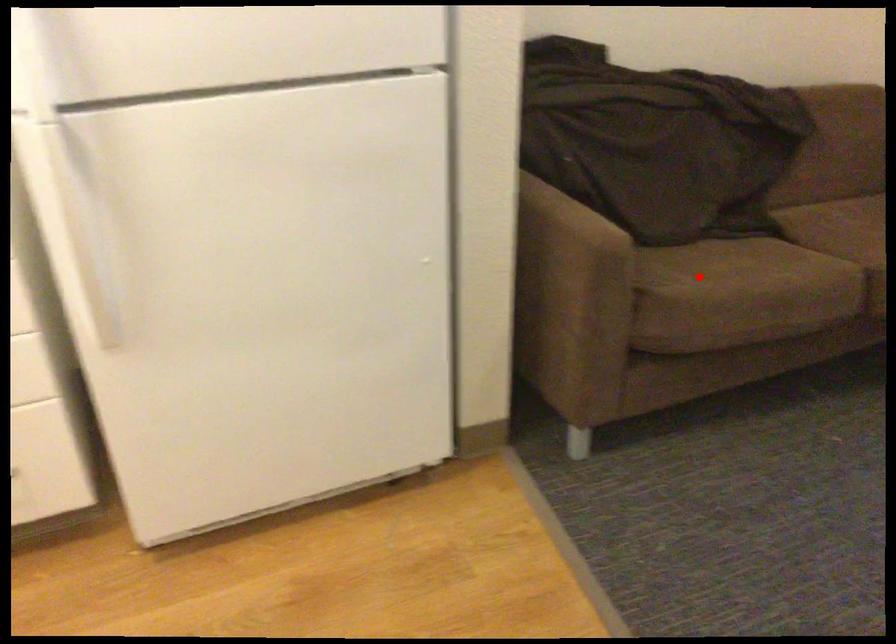
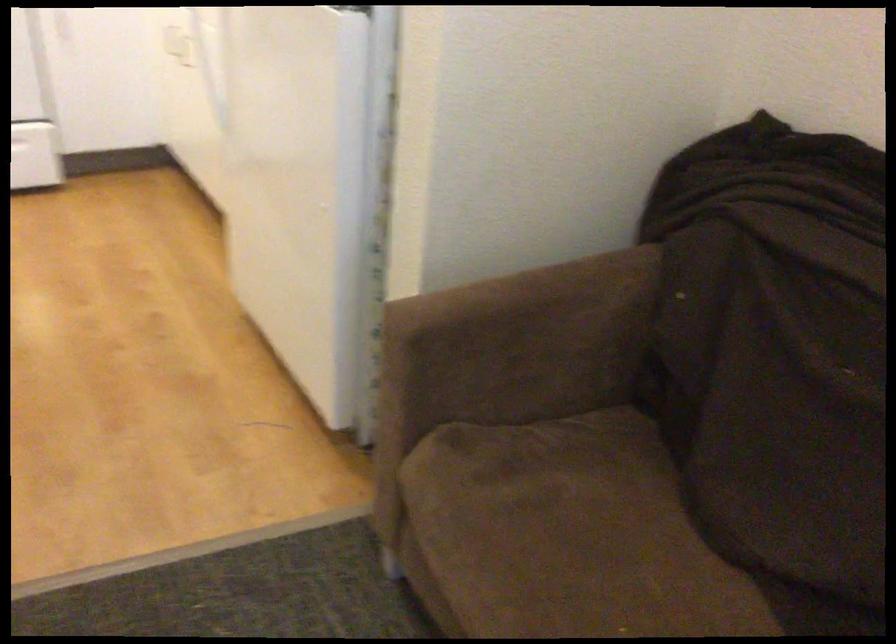
In the second image, find the point that corresponds to the highlighted location in the first image.

(563, 542)